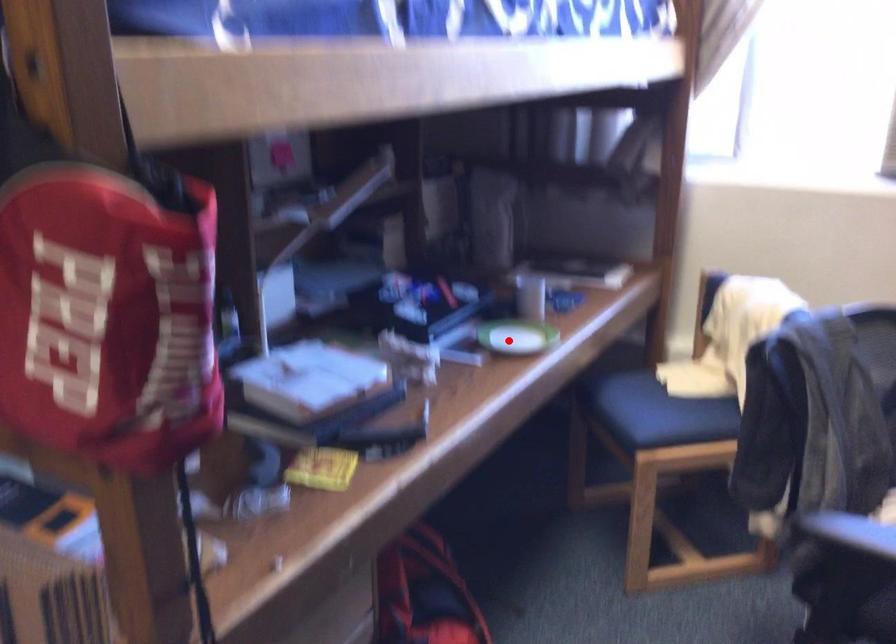
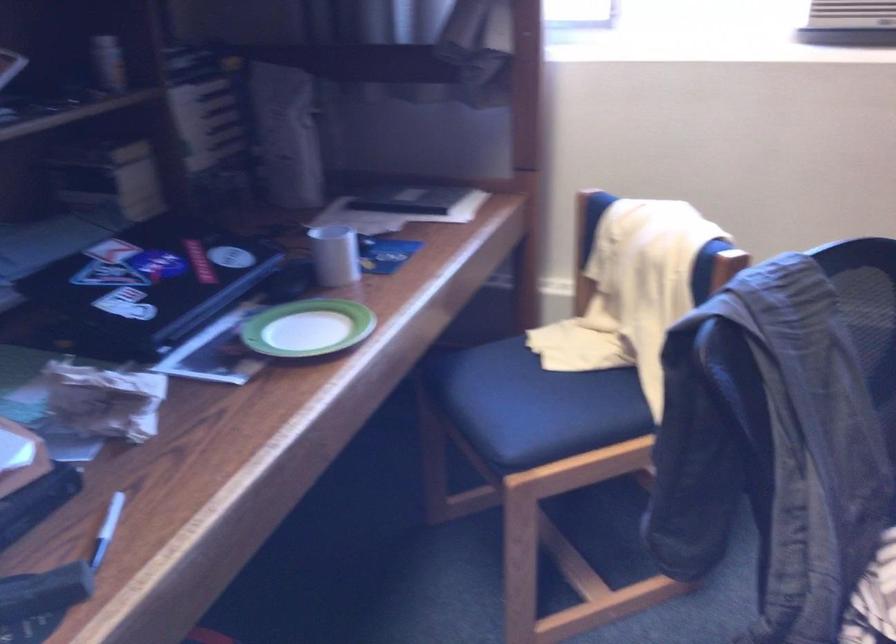
Find the pixel in the second image that matches the highlighted location in the first image.

(307, 328)